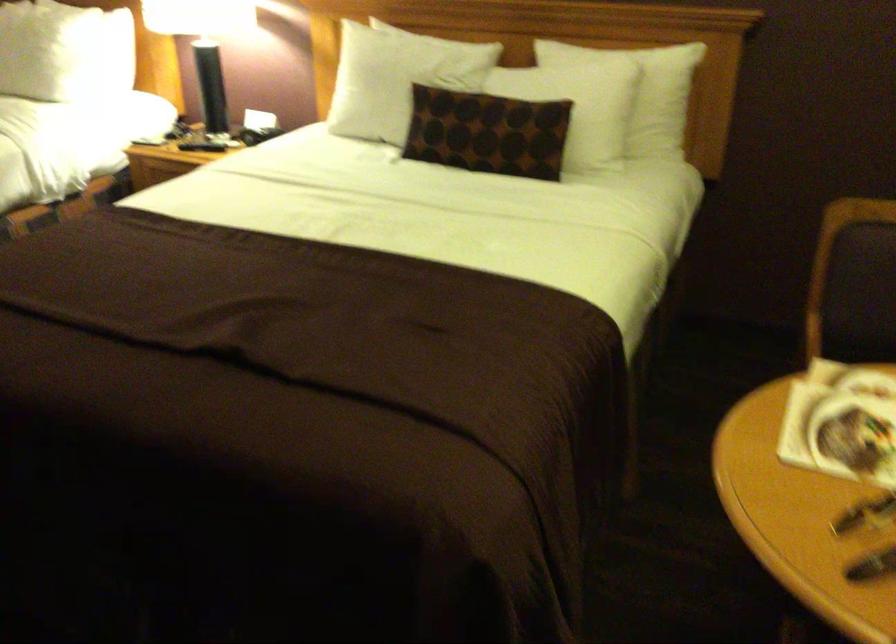
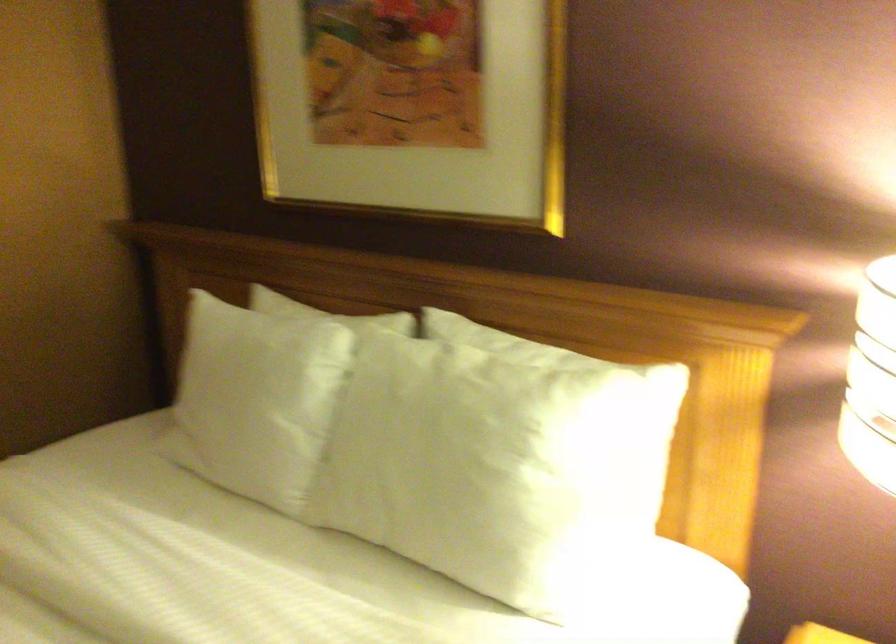
In a continuous first-person perspective shot, in which direction is the camera moving?

The cameraman walked toward left, forward.